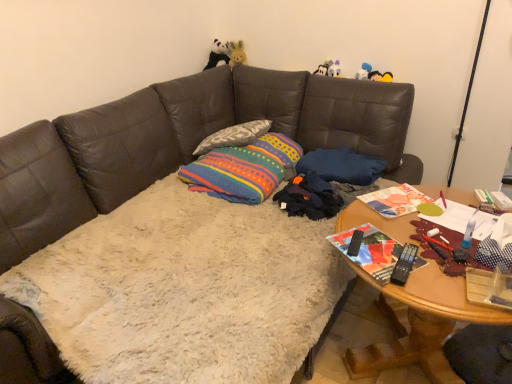
Question: Based on their positions, is multicolored fabric throw pillow at center located to the left or right of white fluffy couch at center?

Choices:
 (A) left
 (B) right

Answer: (B)

Question: From a real-world perspective, relative to white fluffy couch at center, is multicolored fabric throw pillow at center vertically above or below?

Choices:
 (A) below
 (B) above

Answer: (B)

Question: Considering the real-world distances, which object is closest to the blue fabric pillow at center, the first pillow when ordered from right to left?

Choices:
 (A) textured gray pillow at center, the first pillow viewed from the left
 (B) white fluffy couch at center
 (C) black plush panda at upper center
 (D) wooden table at lower right
 (E) multicolored fabric throw pillow at center

Answer: (E)

Question: Estimate the real-world distances between objects in this image. Which object is farther from the multicolored fabric throw pillow at center?

Choices:
 (A) wooden table at lower right
 (B) white fluffy couch at center
 (C) black plush panda at upper center
 (D) textured gray pillow at center, the first pillow viewed from the left
 (E) blue fabric pillow at center, the first pillow when ordered from right to left

Answer: (C)